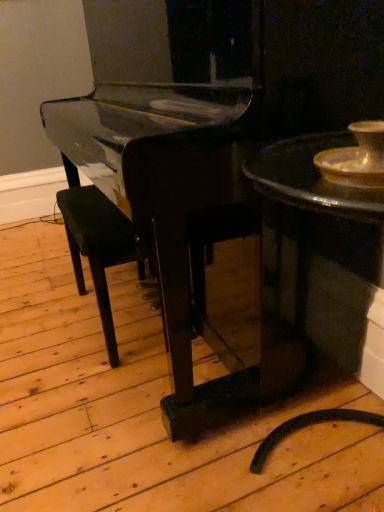
Image resolution: width=384 pixels, height=512 pixels. In order to click on shiny dark wood table at right in this screenshot , I will do `click(315, 253)`.

The image size is (384, 512). What do you see at coordinates (315, 253) in the screenshot?
I see `shiny dark wood table at right` at bounding box center [315, 253].

Describe the element at coordinates (99, 246) in the screenshot. This screenshot has height=512, width=384. I see `black wood armchair at center` at that location.

You are a GUI agent. You are given a task and a screenshot of the screen. Output one action in this format:
    pyautogui.click(x=<x>, y=<y>)
    Task: Click on the black wood armchair at center
    The image size is (384, 512).
    Given the screenshot: What is the action you would take?
    pyautogui.click(x=99, y=246)

Locate an element on the screen. shiny dark wood table at right is located at coordinates (315, 253).

Does black wood armchair at center appear on the left side of shiny dark wood table at right?

Indeed, black wood armchair at center is positioned on the left side of shiny dark wood table at right.

Which object is closer to the camera taking this photo, black wood armchair at center or shiny dark wood table at right?

shiny dark wood table at right.

Does point (104, 333) appear closer or farther from the camera than point (335, 306)?

Clearly, point (104, 333) is more distant from the camera than point (335, 306).

From the image's perspective, is black wood armchair at center beneath shiny dark wood table at right?

Incorrect, from the image's perspective, black wood armchair at center is higher than shiny dark wood table at right.

From a real-world perspective, is black wood armchair at center physically located above or below shiny dark wood table at right?

black wood armchair at center is below shiny dark wood table at right.

Between black wood armchair at center and shiny dark wood table at right, which one has larger width?

shiny dark wood table at right.

Does black wood armchair at center have a greater height compared to shiny dark wood table at right?

In fact, black wood armchair at center may be shorter than shiny dark wood table at right.

Can you confirm if black wood armchair at center is bigger than shiny dark wood table at right?

Incorrect, black wood armchair at center is not larger than shiny dark wood table at right.

Is black wood armchair at center completely or partially outside of shiny dark wood table at right?

black wood armchair at center lies outside shiny dark wood table at right's area.

Is there a large distance between black wood armchair at center and shiny dark wood table at right?

No, black wood armchair at center is in close proximity to shiny dark wood table at right.

Is black wood armchair at center oriented away from shiny dark wood table at right?

black wood armchair at center is not turned away from shiny dark wood table at right.

In the scene shown: How far apart are black wood armchair at center and shiny dark wood table at right?

A distance of 23.45 inches exists between black wood armchair at center and shiny dark wood table at right.

Identify the location of armchair on the left of shiny dark wood table at right. The width and height of the screenshot is (384, 512). (99, 246).

Can you confirm if shiny dark wood table at right is positioned to the left of black wood armchair at center?

No, shiny dark wood table at right is not to the left of black wood armchair at center.

Relative to black wood armchair at center, is shiny dark wood table at right in front or behind?

Clearly, shiny dark wood table at right is in front of black wood armchair at center.

Is point (283, 331) closer to camera compared to point (81, 250)?

Yes, it is.

From the image's perspective, relative to black wood armchair at center, is shiny dark wood table at right above or below?

Clearly, from the image's perspective, shiny dark wood table at right is below black wood armchair at center.

From a real-world perspective, is shiny dark wood table at right above or below black wood armchair at center?

shiny dark wood table at right is above black wood armchair at center.

Looking at their sizes, would you say shiny dark wood table at right is wider or thinner than black wood armchair at center?

Considering their sizes, shiny dark wood table at right looks broader than black wood armchair at center.

Between shiny dark wood table at right and black wood armchair at center, which one has less height?

black wood armchair at center.

Considering the relative sizes of shiny dark wood table at right and black wood armchair at center in the image provided, is shiny dark wood table at right smaller than black wood armchair at center?

No, shiny dark wood table at right is not smaller than black wood armchair at center.

Can black wood armchair at center be found inside shiny dark wood table at right?

No, black wood armchair at center is located outside of shiny dark wood table at right.

From the picture: Is shiny dark wood table at right next to black wood armchair at center and touching it?

shiny dark wood table at right and black wood armchair at center are not in contact.

Based on the photo, is shiny dark wood table at right positioned with its back to black wood armchair at center?

shiny dark wood table at right does not have its back to black wood armchair at center.

How many degrees apart are the facing directions of shiny dark wood table at right and black wood armchair at center?

The facing directions of shiny dark wood table at right and black wood armchair at center are 1.16 degrees apart.

Based on the photo, measure the distance between shiny dark wood table at right and black wood armchair at center.

shiny dark wood table at right is 23.45 inches away from black wood armchair at center.

Find the location of a particular element. Image resolution: width=384 pixels, height=512 pixels. armchair above the shiny dark wood table at right (from the image's perspective) is located at coordinates (99, 246).

Locate an element on the screen. The height and width of the screenshot is (512, 384). table above the black wood armchair at center (from a real-world perspective) is located at coordinates (315, 253).

Locate an element on the screen. This screenshot has width=384, height=512. table on the right of the black wood armchair at center is located at coordinates (315, 253).